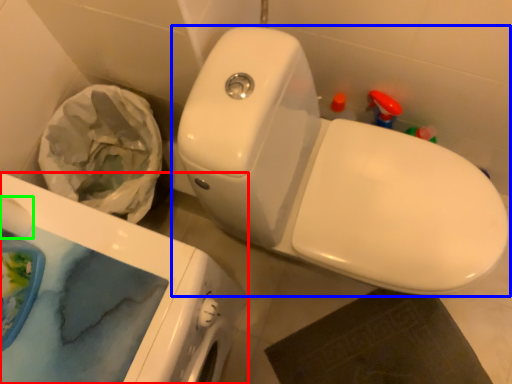
Question: Considering the real-world distances, which object is closest to porcelain (highlighted by a red box)? toilet (highlighted by a blue box) or toilet paper (highlighted by a green box).

Choices:
 (A) toilet
 (B) toilet paper

Answer: (B)